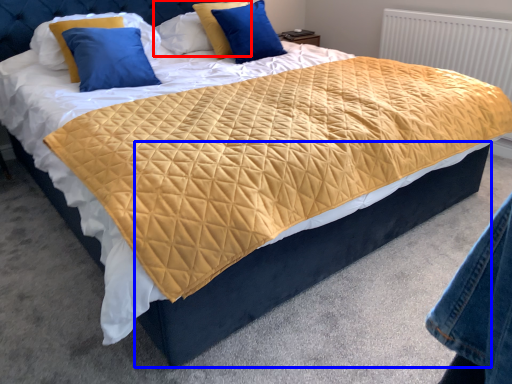
Question: Which object is closer to the camera taking this photo, pillow (highlighted by a red box) or bed frame (highlighted by a blue box)?

Choices:
 (A) pillow
 (B) bed frame

Answer: (B)